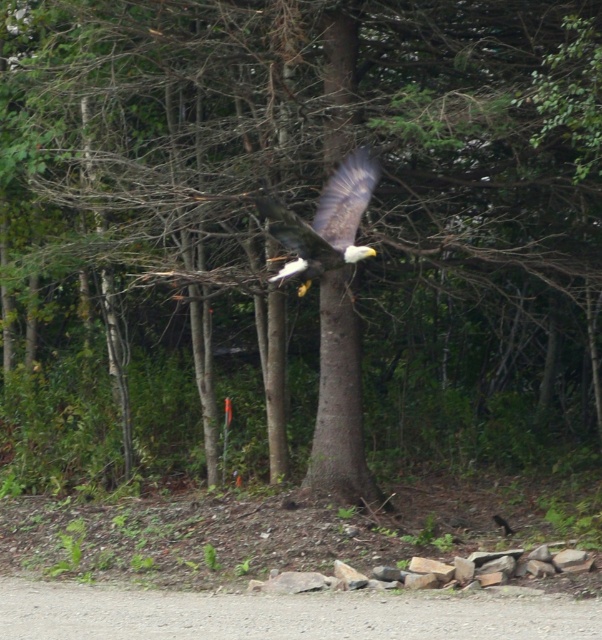
Between brown rough tree trunk at center and dark brown feathers at center, which one has more height?

brown rough tree trunk at center is taller.

Is brown rough tree trunk at center bigger than dark brown feathers at center?

Incorrect, brown rough tree trunk at center is not larger than dark brown feathers at center.

Is point (346, 16) less distant than point (334, 180)?

No, it is not.

The height and width of the screenshot is (640, 602). I want to click on brown rough tree trunk at center, so click(x=338, y=397).